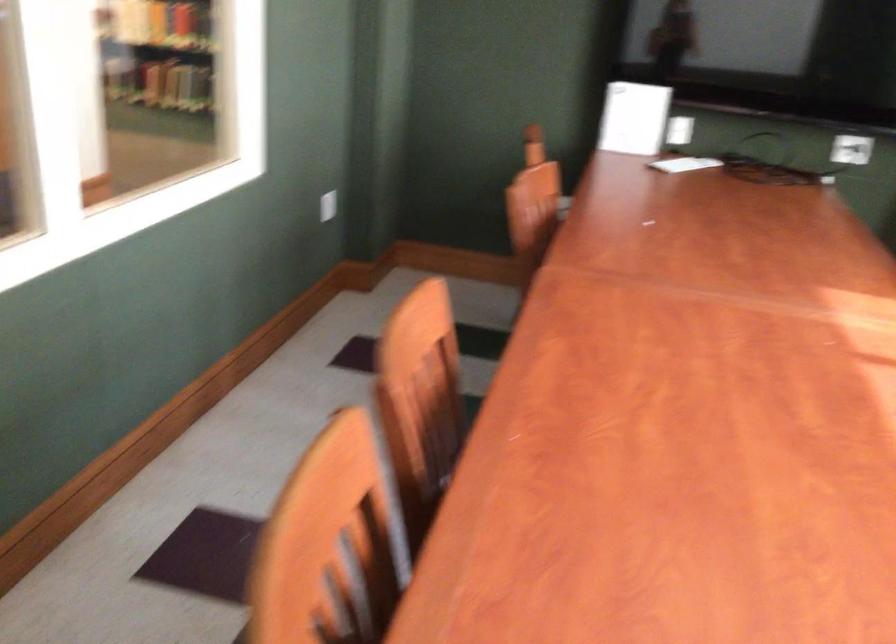
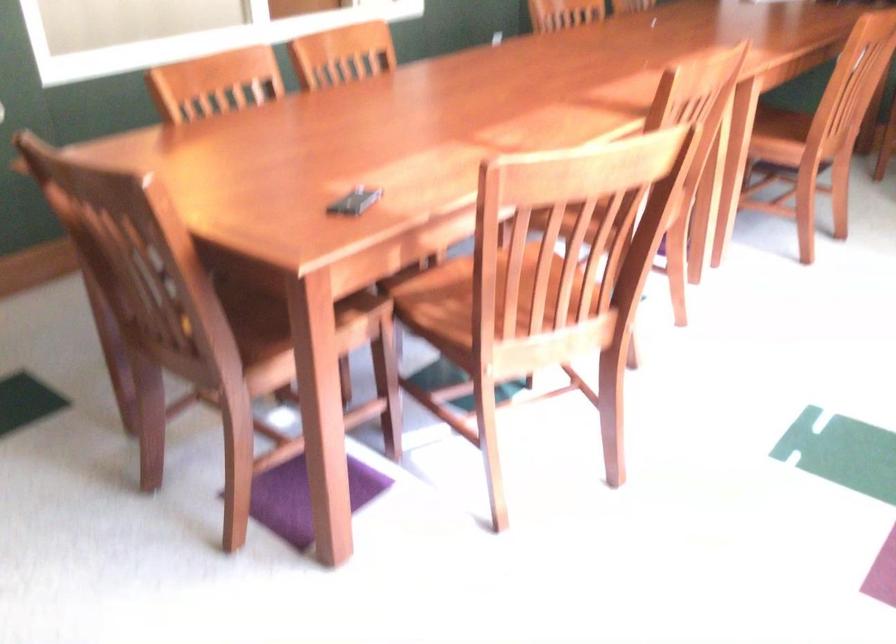
Consider the image. The images are taken continuously from a first-person perspective. In which direction are you moving?

The movement direction of the cameraman is right, backward.